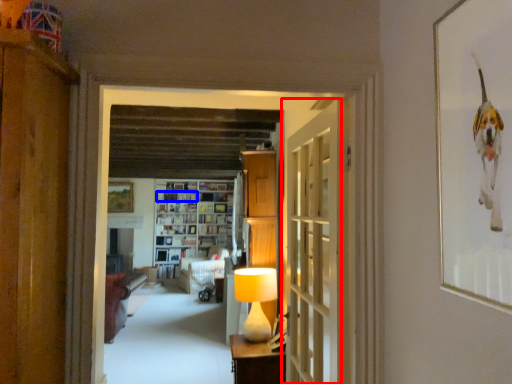
Question: Which of the following is the closest to the observer, door (highlighted by a red box) or book (highlighted by a blue box)?

Choices:
 (A) door
 (B) book

Answer: (A)